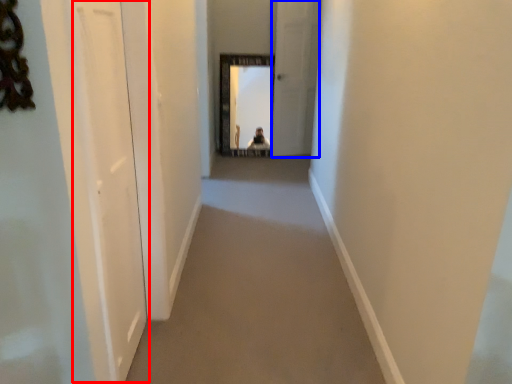
Question: Which object is closer to the camera taking this photo, screen door (highlighted by a red box) or screen door (highlighted by a blue box)?

Choices:
 (A) screen door
 (B) screen door

Answer: (A)